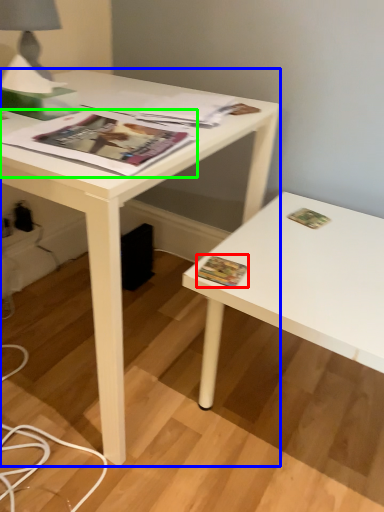
Question: Which object is the closest to the paperback book (highlighted by a red box)? Choose among these: desk (highlighted by a blue box) or magazine (highlighted by a green box).

Choices:
 (A) desk
 (B) magazine

Answer: (B)